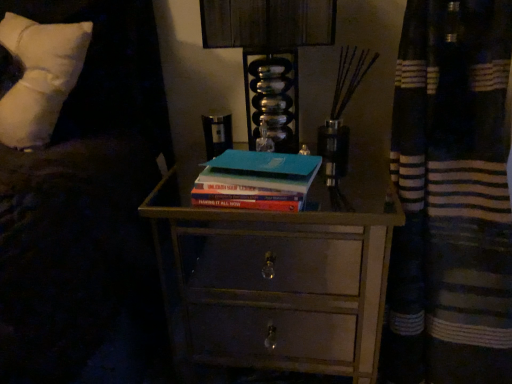
Where is `teal matte book at center`? teal matte book at center is located at coordinates (256, 180).

Locate an element on the screen. This screenshot has height=384, width=512. white soft pillow at upper left is located at coordinates (39, 77).

Which is closer to the camera, (386,238) or (21,112)?

Point (386,238) appears to be farther away from the viewer than point (21,112).

Is wooden chest of drawers at center bigger than white soft pillow at upper left?

Yes, wooden chest of drawers at center is bigger than white soft pillow at upper left.

How far apart are wooden chest of drawers at center and white soft pillow at upper left?

wooden chest of drawers at center and white soft pillow at upper left are 24.44 inches apart from each other.

Would you say wooden chest of drawers at center is a long distance from white soft pillow at upper left?

No, wooden chest of drawers at center is not far away from white soft pillow at upper left.

Is metallic glass at upper center smaller than teal matte book at center?

No.

Which object is further away from the camera taking this photo, metallic glass at upper center or teal matte book at center?

metallic glass at upper center is behind.

Is there a large distance between metallic glass at upper center and teal matte book at center?

No, there isn't a large distance between metallic glass at upper center and teal matte book at center.

Is metallic glass at upper center facing towards teal matte book at center?

Yes, metallic glass at upper center is turned towards teal matte book at center.

Looking at this image, can you tell me how much wooden chest of drawers at center and metallic glass at upper center differ in facing direction?

5.24 degrees.

Considering the relative positions of wooden chest of drawers at center and metallic glass at upper center in the image provided, is wooden chest of drawers at center to the left or to the right of metallic glass at upper center?

Clearly, wooden chest of drawers at center is on the right of metallic glass at upper center in the image.

Considering the sizes of objects wooden chest of drawers at center and metallic glass at upper center in the image provided, who is wider, wooden chest of drawers at center or metallic glass at upper center?

With larger width is wooden chest of drawers at center.

Which is less distant, (190, 176) or (257, 38)?

Point (257, 38)

You are a GUI agent. You are given a task and a screenshot of the screen. Output one action in this format:
    pyautogui.click(x=<x>, y=<y>)
    Task: Click on the bedside lamp on the right of the teal matte book at center
    The height and width of the screenshot is (384, 512).
    Given the screenshot: What is the action you would take?
    pyautogui.click(x=269, y=54)

Is teal matte book at center situated inside metallic glass at upper center or outside?

teal matte book at center is spatially situated outside metallic glass at upper center.

Is point (309, 208) farther from viewer compared to point (296, 185)?

Yes, it is.

Is wooden chest of drawers at center outside of teal matte book at center?

wooden chest of drawers at center lies outside teal matte book at center's area.

Is wooden chest of drawers at center far from teal matte book at center?

No, wooden chest of drawers at center is not far from teal matte book at center.

Is white soft pillow at upper left directly adjacent to wooden chest of drawers at center?

No, white soft pillow at upper left is not in contact with wooden chest of drawers at center.

From the image's perspective, is white soft pillow at upper left below wooden chest of drawers at center?

No, from the image's perspective, white soft pillow at upper left is not below wooden chest of drawers at center.

Is white soft pillow at upper left positioned in front of wooden chest of drawers at center?

Yes, white soft pillow at upper left is closer to the viewer.

Does white soft pillow at upper left have a greater height compared to wooden chest of drawers at center?

No.

Looking at this image, is wooden chest of drawers at center surrounded by teal matte book at center?

No, wooden chest of drawers at center is not inside teal matte book at center.

Is teal matte book at center wider or thinner than wooden chest of drawers at center?

Considering their sizes, teal matte book at center looks slimmer than wooden chest of drawers at center.

Which is in front, point (226, 178) or point (167, 268)?

Positioned in front is point (226, 178).

This screenshot has width=512, height=384. I want to click on the chest of drawers behind the white soft pillow at upper left, so click(277, 275).

Find the location of `bedside lamp lying on the right of teal matte book at center`. bedside lamp lying on the right of teal matte book at center is located at coordinates (269, 54).

Estimate the real-world distances between objects in this image. Which object is closer to metallic glass at upper center, wooden chest of drawers at center or teal matte book at center?

teal matte book at center lies closer to metallic glass at upper center than the other object.

Considering their positions, is metallic glass at upper center positioned closer to white soft pillow at upper left than wooden chest of drawers at center?

metallic glass at upper center is closer to white soft pillow at upper left.

Which object lies further to the anchor point white soft pillow at upper left, metallic glass at upper center or teal matte book at center?

teal matte book at center is positioned further to the anchor white soft pillow at upper left.

Considering their positions, is white soft pillow at upper left positioned further to metallic glass at upper center than teal matte book at center?

The object further to metallic glass at upper center is white soft pillow at upper left.

Estimate the real-world distances between objects in this image. Which object is further from teal matte book at center, metallic glass at upper center or white soft pillow at upper left?

Among the two, white soft pillow at upper left is located further to teal matte book at center.

When comparing their distances from wooden chest of drawers at center, does teal matte book at center or metallic glass at upper center seem closer?

Among the two, metallic glass at upper center is located nearer to wooden chest of drawers at center.

Considering their positions, is wooden chest of drawers at center positioned closer to teal matte book at center than white soft pillow at upper left?

white soft pillow at upper left is positioned closer to the anchor teal matte book at center.

Considering their positions, is teal matte book at center positioned closer to white soft pillow at upper left than metallic glass at upper center?

Among the two, metallic glass at upper center is located nearer to white soft pillow at upper left.

The height and width of the screenshot is (384, 512). In order to click on paperback book located between white soft pillow at upper left and metallic glass at upper center in the left-right direction in this screenshot , I will do `click(256, 180)`.

The image size is (512, 384). Identify the location of bedside lamp between white soft pillow at upper left and wooden chest of drawers at center in the horizontal direction. (269, 54).

This screenshot has width=512, height=384. I want to click on paperback book between white soft pillow at upper left and wooden chest of drawers at center from left to right, so click(256, 180).

Locate an element on the screen. The width and height of the screenshot is (512, 384). paperback book between metallic glass at upper center and wooden chest of drawers at center vertically is located at coordinates [x=256, y=180].